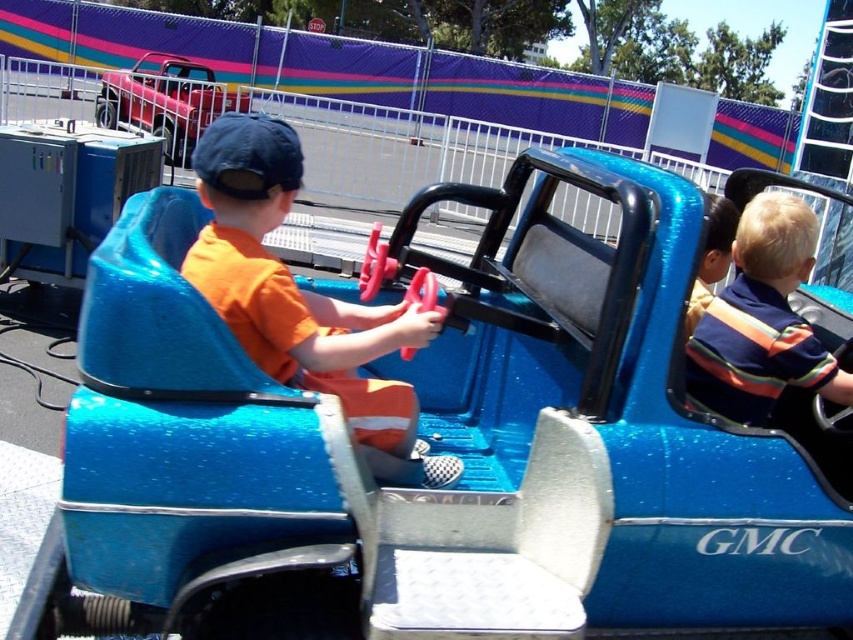
You are a photographer at the fairground. You need to take a photo of both the striped cotton shirt at center and the striped shirt at center. Which shirt should you focus on first if you want to capture the wider one in your shot?

The striped cotton shirt at center is wider than the striped shirt at center, so you should focus on the striped cotton shirt at center first to capture its wider width in the photo.

You are standing at the origin point in the image. Where is the orange fabric shirt at center located in terms of coordinates?

The orange fabric shirt at center is located at coordinates point (299, 292).